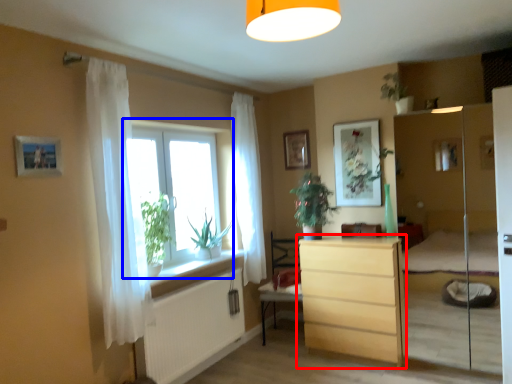
Question: Among these objects, which one is nearest to the camera, chest of drawers (highlighted by a red box) or window (highlighted by a blue box)?

Choices:
 (A) chest of drawers
 (B) window

Answer: (B)